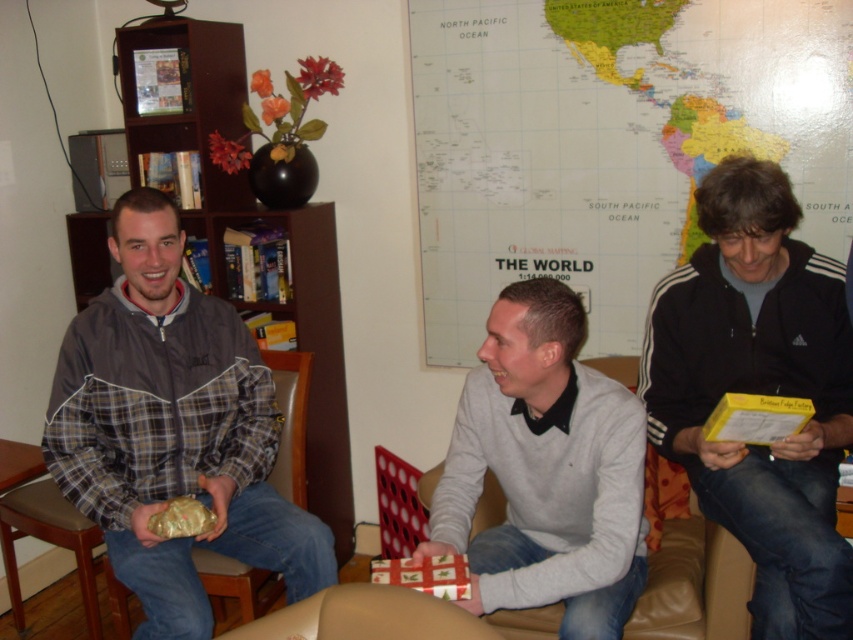
You are planning to hang a large painting that is 2 meters tall on the wall where the world map at center is currently displayed. Considering the space, will the painting fit without overlapping the brown leather armchair at lower left?

The world map at center is much taller than the brown leather armchair at lower left. Since the painting is 2 meters tall, it should fit as long as there is enough vertical space on the wall. However, the description does not provide exact dimensions of the wall or the distance between the map and the armchair, so we cannot confirm if it will overlap. More information is needed.

Consider the image. You are a photographer standing in the living room and want to take a photo of the black matte jacket at right and the light gray sweater at center. Which one will appear larger in the photo?

The black matte jacket at right appears larger in the photo because it is taller than the light gray sweater at center.

In the scene shown: You are a delivery robot with a 1.0 meter wide package. You need to move between the plaid fabric jacket at center and the black matte jacket at right. Can your package fit through the space between them?

The space between the plaid fabric jacket at center and the black matte jacket at right is 1.06 meters. Since your package is 1.0 meters wide, it can fit through the space as there is enough width available.